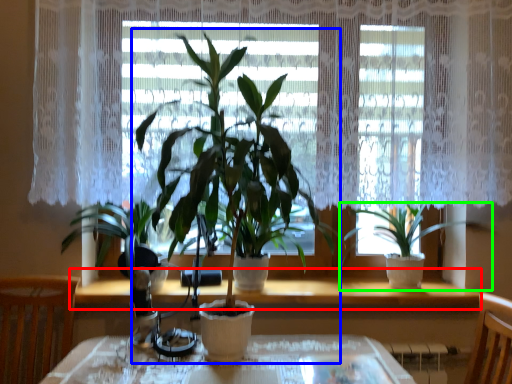
Question: Considering the real-world distances, which object is closest to window sill (highlighted by a red box)? houseplant (highlighted by a blue box) or houseplant (highlighted by a green box).

Choices:
 (A) houseplant
 (B) houseplant

Answer: (B)